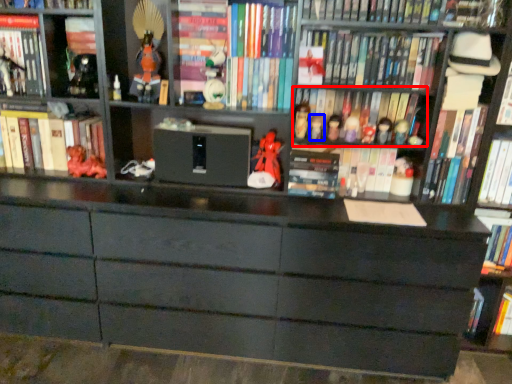
Question: Which object appears farthest to the camera in this image, book (highlighted by a red box) or toy (highlighted by a blue box)?

Choices:
 (A) book
 (B) toy

Answer: (A)